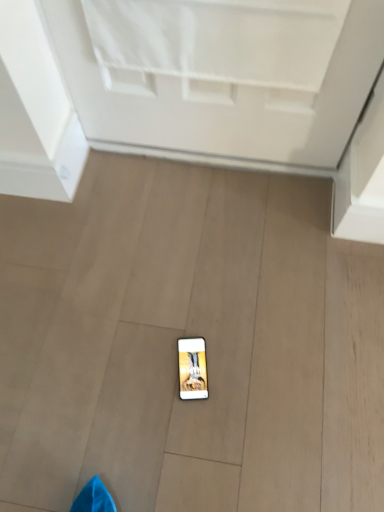
Question: Should I look upward or downward to see matte black phone at center?

Choices:
 (A) up
 (B) down

Answer: (B)